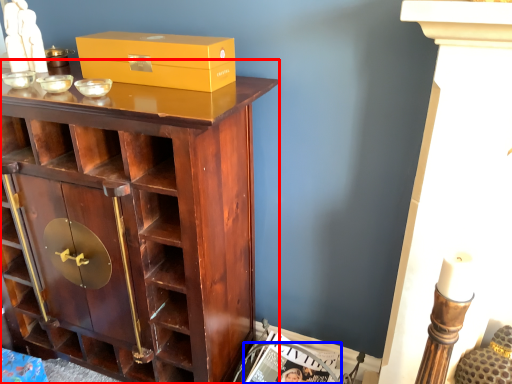
Question: Which point is further to the camera, cupboard (highlighted by a red box) or magazine (highlighted by a blue box)?

Choices:
 (A) cupboard
 (B) magazine

Answer: (B)